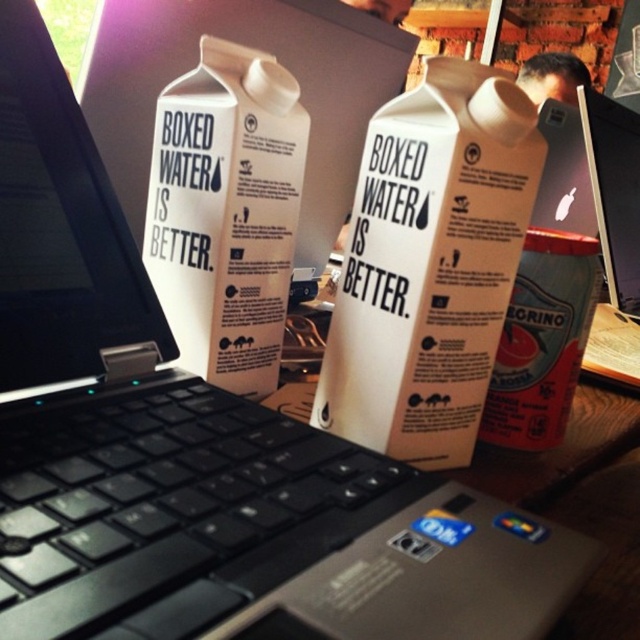
Question: Is the position of black plastic keyboard at center more distant than that of white matte carton at center?

Choices:
 (A) no
 (B) yes

Answer: (A)

Question: Does white matte carton at center appear over metallic silver can at right?

Choices:
 (A) no
 (B) yes

Answer: (B)

Question: Which is farther from the white matte carton at center?

Choices:
 (A) black plastic keyboard at center
 (B) metallic silver can at right

Answer: (B)

Question: Which object is farther from the camera taking this photo?

Choices:
 (A) black plastic keyboard at center
 (B) metallic silver can at right
 (C) white matte carton at center

Answer: (B)

Question: Among these objects, which one is nearest to the camera?

Choices:
 (A) metallic silver can at right
 (B) black plastic keyboard at center

Answer: (B)

Question: Observing the image, what is the correct spatial positioning of white matte carton at center in reference to metallic silver can at right?

Choices:
 (A) below
 (B) above

Answer: (B)